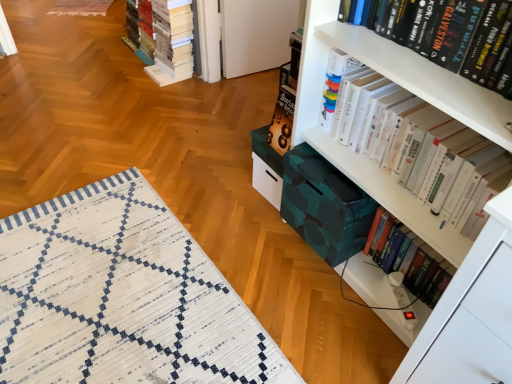
Question: Is hardcover book at lower right, acting as the 1th book starting from the right, directly adjacent to white woven mat at lower left?

Choices:
 (A) no
 (B) yes

Answer: (A)

Question: From a real-world perspective, is hardcover book at lower right, acting as the 1th book starting from the right, located higher than white woven mat at lower left?

Choices:
 (A) yes
 (B) no

Answer: (A)

Question: From the image's perspective, would you say hardcover book at lower right, placed as the second book when sorted from back to front, is positioned over white woven mat at lower left?

Choices:
 (A) no
 (B) yes

Answer: (B)

Question: Does hardcover book at lower right, which is the third book from front to back, have a greater width compared to white woven mat at lower left?

Choices:
 (A) yes
 (B) no

Answer: (B)

Question: Does hardcover book at lower right, acting as the 1th book starting from the right, turn towards white woven mat at lower left?

Choices:
 (A) no
 (B) yes

Answer: (B)

Question: From a real-world perspective, is hardcover book at lower right, acting as the 1th book starting from the right, physically located above or below white paper book at upper left, which is counted as the 4th book, starting from the right?

Choices:
 (A) above
 (B) below

Answer: (B)

Question: Do you think hardcover book at lower right, placed as the second book when sorted from back to front, is within white paper book at upper left, the 1th book positioned from the left, or outside of it?

Choices:
 (A) outside
 (B) inside

Answer: (A)

Question: Is point (376, 228) closer or farther from the camera than point (162, 33)?

Choices:
 (A) farther
 (B) closer

Answer: (B)

Question: Considering the positions of hardcover book at lower right, which is the third book from front to back, and white paper book at upper left, the 4th book when ordered from front to back, in the image, is hardcover book at lower right, which is the third book from front to back, taller or shorter than white paper book at upper left, the 4th book when ordered from front to back,?

Choices:
 (A) short
 (B) tall

Answer: (A)

Question: From their relative heights in the image, would you say white glossy book at upper right, acting as the 3th book starting from the left, is taller or shorter than white paper book at upper left, the 1th book positioned from the left?

Choices:
 (A) short
 (B) tall

Answer: (A)

Question: From the image's perspective, is white glossy book at upper right, the 2th book viewed from the right, located above or below white paper book at upper left, which is counted as the 4th book, starting from the right?

Choices:
 (A) above
 (B) below

Answer: (B)

Question: Looking at their shapes, would you say white glossy book at upper right, which is counted as the second book, starting from the front, is wider or thinner than white paper book at upper left, the 4th book when ordered from front to back?

Choices:
 (A) thin
 (B) wide

Answer: (A)

Question: Considering the positions of point (493, 148) and point (175, 3), is point (493, 148) closer or farther from the camera than point (175, 3)?

Choices:
 (A) closer
 (B) farther

Answer: (A)

Question: Considering the positions of white paper book at upper left, the 4th book when ordered from front to back, and hardcover book at lower right, placed as the second book when sorted from back to front, in the image, is white paper book at upper left, the 4th book when ordered from front to back, taller or shorter than hardcover book at lower right, placed as the second book when sorted from back to front,?

Choices:
 (A) short
 (B) tall

Answer: (B)

Question: Considering the relative positions of white paper book at upper left, which is counted as the 4th book, starting from the right, and hardcover book at lower right, which is the third book from front to back, in the image provided, is white paper book at upper left, which is counted as the 4th book, starting from the right, to the left or to the right of hardcover book at lower right, which is the third book from front to back,?

Choices:
 (A) right
 (B) left

Answer: (B)